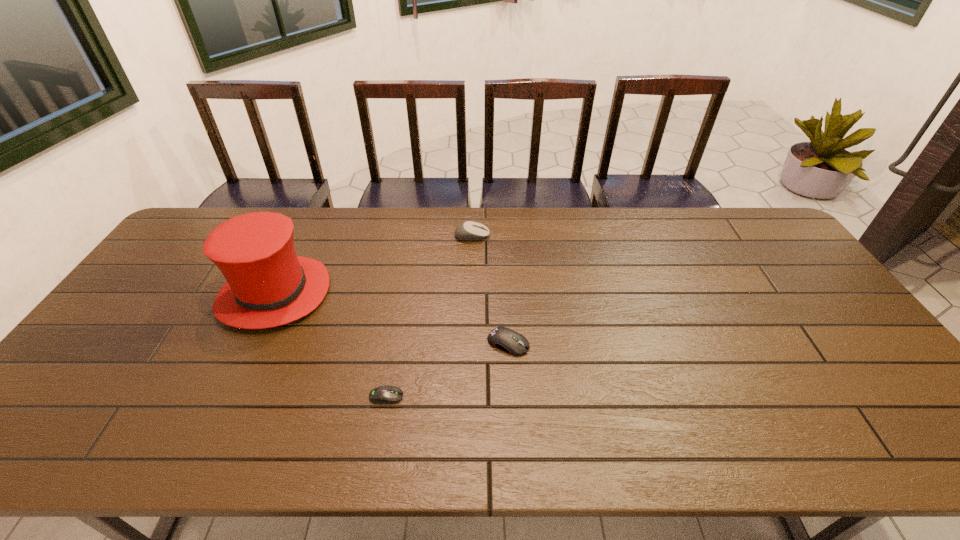
I want to click on computer mouse that is the closest to the hat, so click(x=383, y=394).

This screenshot has height=540, width=960. I want to click on computer mouse that is the closest to the second tallest object, so click(x=508, y=340).

Where is `vacant space that satisfies the following two spatial constraints: 1. on the wheel side of the tallest computer mouse; 2. on the front side of the tallest object`? The width and height of the screenshot is (960, 540). vacant space that satisfies the following two spatial constraints: 1. on the wheel side of the tallest computer mouse; 2. on the front side of the tallest object is located at coordinates (471, 294).

Image resolution: width=960 pixels, height=540 pixels. Identify the location of vacant space that satisfies the following two spatial constraints: 1. on the wheel side of the farthest object; 2. on the left side of the second nearest computer mouse. (469, 343).

Find the location of `vacant region that satisfies the following two spatial constraints: 1. on the back side of the second shortest object; 2. on the wheel side of the tallest computer mouse`. vacant region that satisfies the following two spatial constraints: 1. on the back side of the second shortest object; 2. on the wheel side of the tallest computer mouse is located at coordinates (502, 236).

The width and height of the screenshot is (960, 540). Find the location of `vacant space that satisfies the following two spatial constraints: 1. on the front side of the third tallest object; 2. on the left side of the tallest object`. vacant space that satisfies the following two spatial constraints: 1. on the front side of the third tallest object; 2. on the left side of the tallest object is located at coordinates (251, 343).